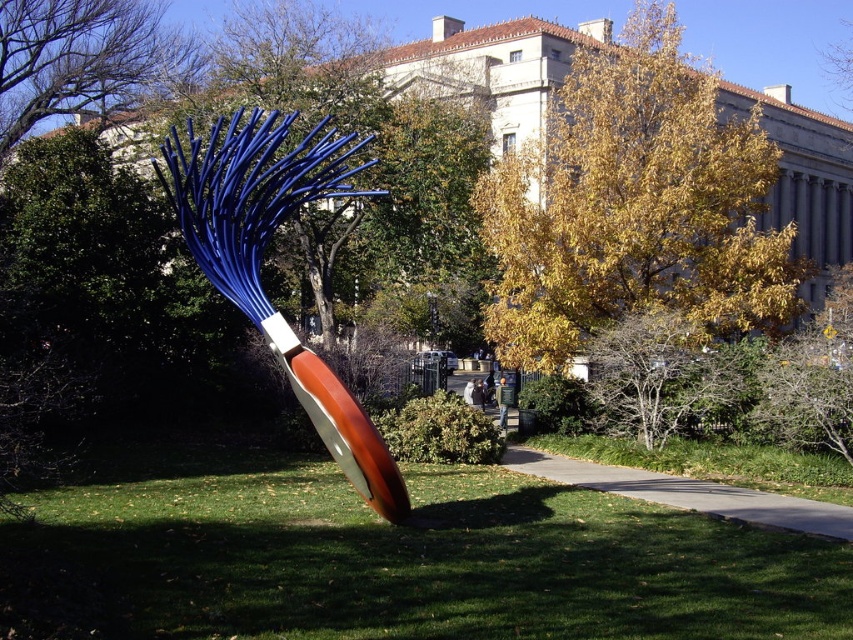
Is shiny blue metal brush at center to the left of green grass at lower center from the viewer's perspective?

Yes, shiny blue metal brush at center is to the left of green grass at lower center.

You are a GUI agent. You are given a task and a screenshot of the screen. Output one action in this format:
    pyautogui.click(x=<x>, y=<y>)
    Task: Click on the shiny blue metal brush at center
    
    Given the screenshot: What is the action you would take?
    pyautogui.click(x=260, y=259)

Does golden leafy tree at upper center have a lesser width compared to green grass at lower center?

No.

Can you confirm if golden leafy tree at upper center is smaller than green grass at lower center?

Incorrect, golden leafy tree at upper center is not smaller in size than green grass at lower center.

You are a GUI agent. You are given a task and a screenshot of the screen. Output one action in this format:
    pyautogui.click(x=<x>, y=<y>)
    Task: Click on the golden leafy tree at upper center
    The width and height of the screenshot is (853, 640).
    Given the screenshot: What is the action you would take?
    pyautogui.click(x=634, y=205)

Where is `golden leafy tree at upper center`? This screenshot has height=640, width=853. golden leafy tree at upper center is located at coordinates (634, 205).

Is golden leafy tree at upper center thinner than bare branches at upper left?

In fact, golden leafy tree at upper center might be wider than bare branches at upper left.

Who is taller, golden leafy tree at upper center or bare branches at upper left?

golden leafy tree at upper center is taller.

Is point (633, 45) farther from viewer compared to point (94, 65)?

That is False.

Find the location of a particular element. golden leafy tree at upper center is located at coordinates (634, 205).